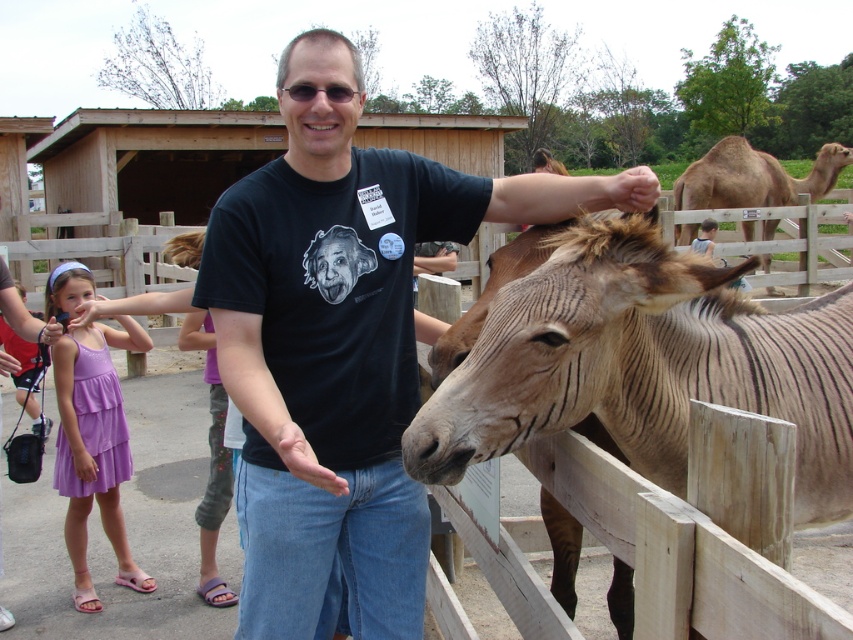
Question: Which object is closer to the camera taking this photo?

Choices:
 (A) brown textured donkey at upper right
 (B) black cotton t-shirt at center
 (C) brown textured donkey at center

Answer: (C)

Question: Which point is closer to the camera taking this photo?

Choices:
 (A) (569, 387)
 (B) (724, 192)
 (C) (80, 356)
 (D) (296, 589)

Answer: (A)

Question: Estimate the real-world distances between objects in this image. Which object is farther from the purple fabric pants at lower left?

Choices:
 (A) black cotton t-shirt at center
 (B) brown textured donkey at center

Answer: (B)

Question: Does brown textured donkey at center have a greater width compared to brown textured donkey at upper right?

Choices:
 (A) yes
 (B) no

Answer: (B)

Question: Does purple fabric pants at lower left appear on the right side of matte black hand at upper center?

Choices:
 (A) yes
 (B) no

Answer: (B)

Question: Can you confirm if purple cotton dress at lower left is wider than brown textured donkey at upper right?

Choices:
 (A) yes
 (B) no

Answer: (B)